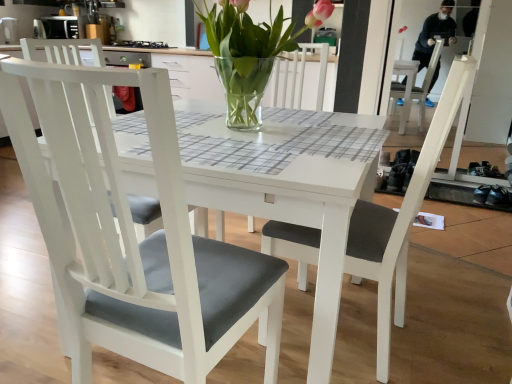
Identify the location of vacant region under clear glass vase at center (from a real-world perspective). The image size is (512, 384). (246, 126).